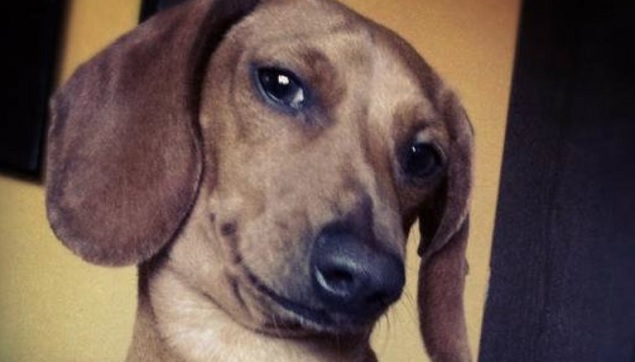
The width and height of the screenshot is (635, 362). In order to click on wall in this screenshot , I will do `click(75, 294)`.